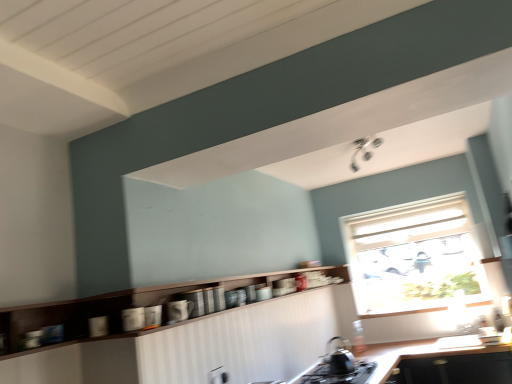
Question: Is black matte gas stove at lower center thinner than white textured window at upper right?

Choices:
 (A) yes
 (B) no

Answer: (B)

Question: Considering the relative positions of black matte gas stove at lower center and white textured window at upper right in the image provided, is black matte gas stove at lower center to the right of white textured window at upper right from the viewer's perspective?

Choices:
 (A) no
 (B) yes

Answer: (A)

Question: Would you say white textured window at upper right is part of black matte gas stove at lower center's contents?

Choices:
 (A) no
 (B) yes

Answer: (A)

Question: Can you see black matte gas stove at lower center touching white textured window at upper right?

Choices:
 (A) yes
 (B) no

Answer: (B)

Question: Does black matte gas stove at lower center have a greater height compared to white textured window at upper right?

Choices:
 (A) no
 (B) yes

Answer: (A)

Question: Is black matte gas stove at lower center completely or partially outside of white textured window at upper right?

Choices:
 (A) no
 (B) yes

Answer: (B)

Question: Is black matte tea pot at lower center smaller than black matte countertop at lower center?

Choices:
 (A) yes
 (B) no

Answer: (A)

Question: Is black matte tea pot at lower center completely or partially outside of black matte countertop at lower center?

Choices:
 (A) yes
 (B) no

Answer: (A)

Question: From the image's perspective, does black matte tea pot at lower center appear lower than black matte countertop at lower center?

Choices:
 (A) no
 (B) yes

Answer: (A)

Question: From a real-world perspective, is black matte tea pot at lower center on top of black matte countertop at lower center?

Choices:
 (A) no
 (B) yes

Answer: (B)

Question: Is black matte tea pot at lower center positioned before black matte countertop at lower center?

Choices:
 (A) no
 (B) yes

Answer: (A)

Question: Is black matte tea pot at lower center far from black matte countertop at lower center?

Choices:
 (A) yes
 (B) no

Answer: (B)

Question: Is white textured window at upper right placed right next to glossy ceramic mug at lower center, the first appliance viewed from the front?

Choices:
 (A) no
 (B) yes

Answer: (A)